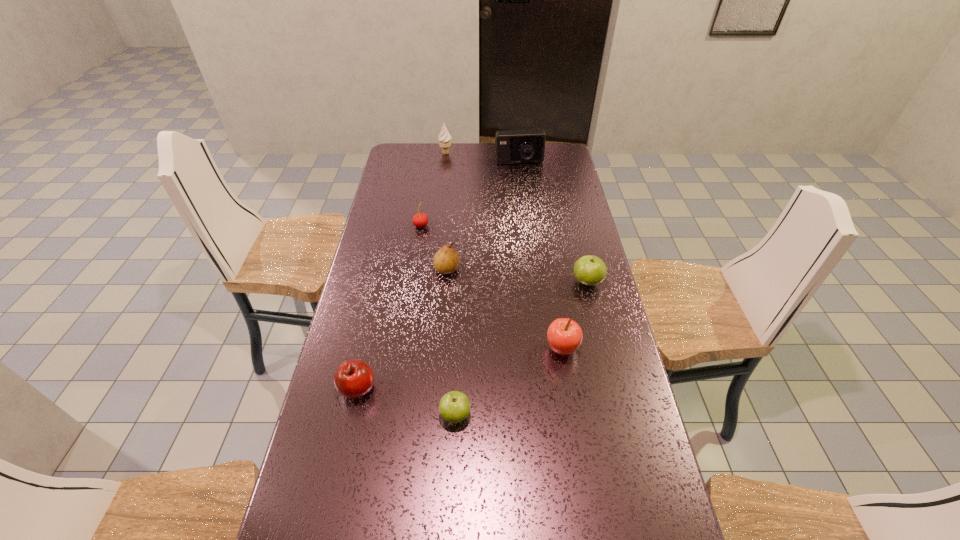
Locate an element on the screen. vacant area situated on the right of the cherry is located at coordinates (463, 226).

Identify the location of vacant region located 0.160m on the back of the nearer green apple. The width and height of the screenshot is (960, 540). (458, 351).

Identify the location of icecream located in the far edge section of the desktop. (444, 138).

Identify the location of camera situated at the far edge. The height and width of the screenshot is (540, 960). (512, 146).

Identify the location of apple that is positioned at the left edge. (353, 378).

In order to click on cherry present at the left edge in this screenshot , I will do `click(420, 220)`.

Image resolution: width=960 pixels, height=540 pixels. I want to click on camera positioned at the right edge, so click(x=512, y=146).

Where is `object that is at the far right corner`? object that is at the far right corner is located at coordinates 512,146.

This screenshot has height=540, width=960. In the image, there is a desktop. Identify the location of vacant space at the far edge. (440, 157).

In order to click on free location at the left edge in this screenshot , I will do `click(361, 456)`.